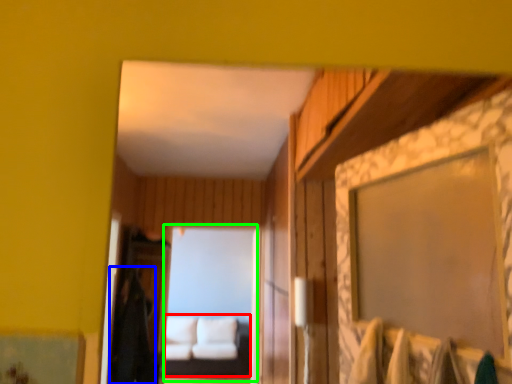
Question: Which is farther away from couch (highlighted by a red box)? robe (highlighted by a blue box) or mirror (highlighted by a green box)?

Choices:
 (A) robe
 (B) mirror

Answer: (A)